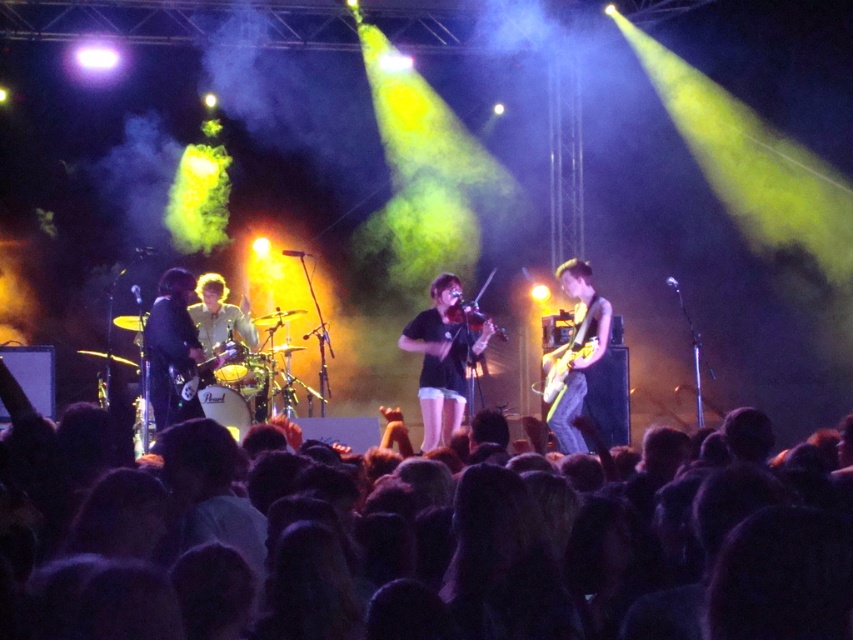
Question: From the image, what is the correct spatial relationship of dark hair at lower center in relation to wooden violin at center?

Choices:
 (A) left
 (B) right

Answer: (A)

Question: Which of these objects is positioned farthest from the dark hair at lower center?

Choices:
 (A) wooden violin at center
 (B) shiny black guitar at center
 (C) glossy electric guitar at center
 (D) shiny black guitar at left

Answer: (A)

Question: Is the position of shiny black guitar at left less distant than that of wooden violin at center?

Choices:
 (A) yes
 (B) no

Answer: (A)

Question: Which point appears farthest from the camera in this image?

Choices:
 (A) (425, 426)
 (B) (496, 332)
 (C) (561, 362)

Answer: (A)

Question: Which object is farther from the camera taking this photo?

Choices:
 (A) black matte violin at center
 (B) glossy electric guitar at center
 (C) shiny black guitar at left

Answer: (B)

Question: Considering the relative positions of shiny black guitar at center and shiny black guitar at left in the image provided, where is shiny black guitar at center located with respect to shiny black guitar at left?

Choices:
 (A) below
 (B) above

Answer: (A)